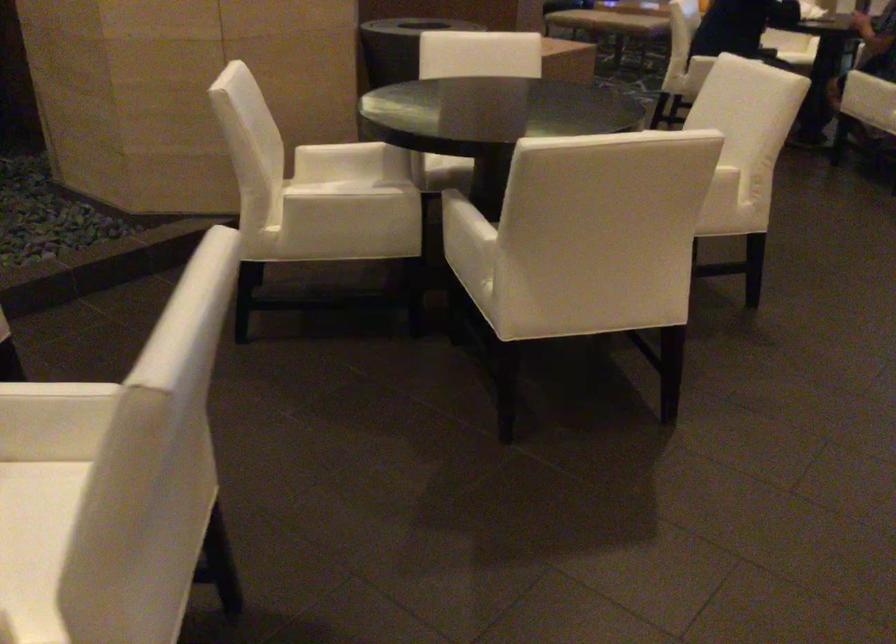
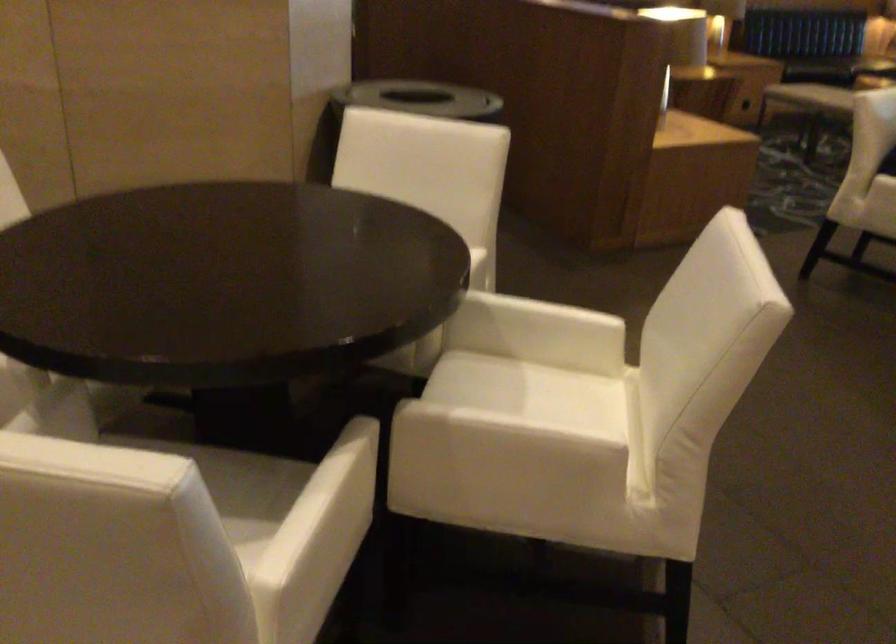
The images are taken continuously from a first-person perspective. In which direction are you moving?

The cameraman walked toward right, forward.